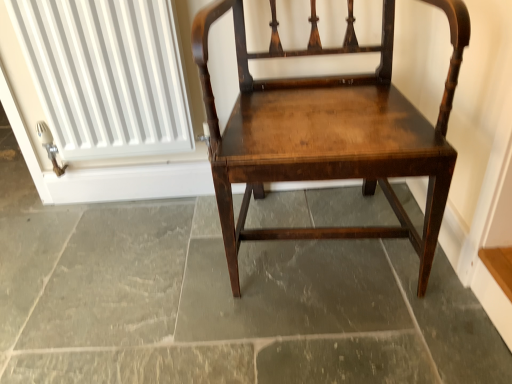
Question: Does dark gray stone floor at center come in front of shiny dark wood chair at center?

Choices:
 (A) yes
 (B) no

Answer: (B)

Question: Can you confirm if dark gray stone floor at center is smaller than shiny dark wood chair at center?

Choices:
 (A) no
 (B) yes

Answer: (B)

Question: Can you see dark gray stone floor at center touching shiny dark wood chair at center?

Choices:
 (A) no
 (B) yes

Answer: (A)

Question: From the image's perspective, is dark gray stone floor at center located beneath shiny dark wood chair at center?

Choices:
 (A) no
 (B) yes

Answer: (B)

Question: From a real-world perspective, is dark gray stone floor at center beneath shiny dark wood chair at center?

Choices:
 (A) yes
 (B) no

Answer: (A)

Question: From a real-world perspective, relative to dark gray stone floor at center, is shiny dark wood chair at center vertically above or below?

Choices:
 (A) above
 (B) below

Answer: (A)

Question: From the image's perspective, is shiny dark wood chair at center above or below dark gray stone floor at center?

Choices:
 (A) below
 (B) above

Answer: (B)

Question: Does point (389, 109) appear closer or farther from the camera than point (202, 289)?

Choices:
 (A) closer
 (B) farther

Answer: (A)

Question: Considering the relative positions of shiny dark wood chair at center and dark gray stone floor at center in the image provided, is shiny dark wood chair at center to the left or to the right of dark gray stone floor at center?

Choices:
 (A) right
 (B) left

Answer: (A)

Question: In terms of width, does white ribbed radiator at upper left look wider or thinner when compared to dark gray stone floor at center?

Choices:
 (A) thin
 (B) wide

Answer: (A)

Question: From the image's perspective, is white ribbed radiator at upper left positioned above or below dark gray stone floor at center?

Choices:
 (A) above
 (B) below

Answer: (A)

Question: In the image, is white ribbed radiator at upper left positioned in front of or behind dark gray stone floor at center?

Choices:
 (A) front
 (B) behind

Answer: (B)

Question: From a real-world perspective, is white ribbed radiator at upper left above or below dark gray stone floor at center?

Choices:
 (A) below
 (B) above

Answer: (B)

Question: Looking at their shapes, would you say dark gray stone floor at center is wider or thinner than white ribbed radiator at upper left?

Choices:
 (A) thin
 (B) wide

Answer: (B)

Question: Is point (78, 223) positioned closer to the camera than point (114, 81)?

Choices:
 (A) closer
 (B) farther

Answer: (B)